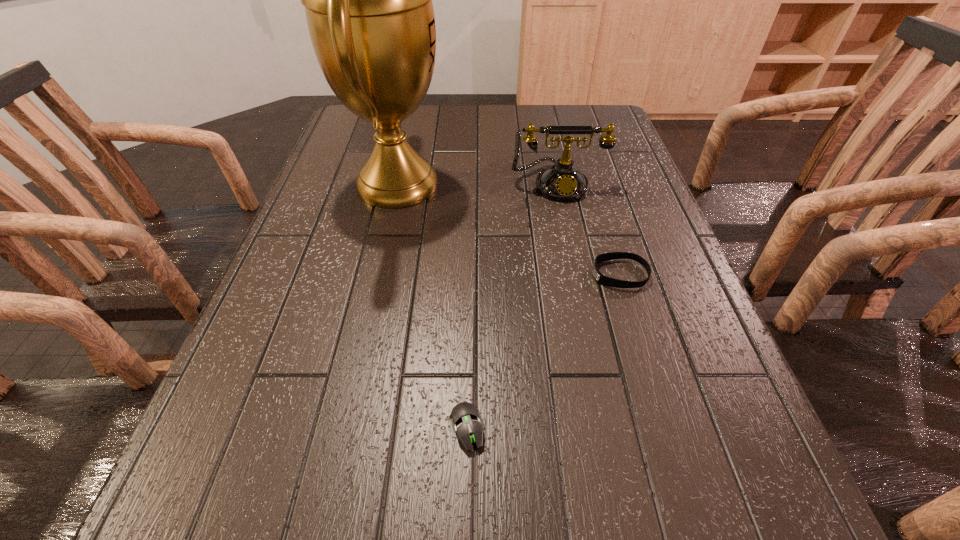
Where is `vacant space situated on the display of the third tallest object`? The image size is (960, 540). vacant space situated on the display of the third tallest object is located at coordinates (487, 274).

Locate an element on the screen. vacant space located 0.080m on the display of the third tallest object is located at coordinates pyautogui.click(x=554, y=274).

The height and width of the screenshot is (540, 960). Identify the location of vacant space positioned on the back of the computer mouse. coord(468,345).

Identify the location of object that is positioned at the far edge. The height and width of the screenshot is (540, 960). (368, 0).

This screenshot has width=960, height=540. Find the location of `object located at the left edge`. object located at the left edge is located at coordinates (368, 0).

The image size is (960, 540). I want to click on telephone that is at the right edge, so click(x=562, y=181).

Where is `wristband present at the right edge`? This screenshot has height=540, width=960. wristband present at the right edge is located at coordinates (600, 278).

What are the coordinates of `object present at the far left corner` in the screenshot? It's located at (368, 0).

Image resolution: width=960 pixels, height=540 pixels. In the image, there is a desktop. What are the coordinates of `vacant space at the far edge` in the screenshot? It's located at (422, 117).

The height and width of the screenshot is (540, 960). I want to click on vacant area at the near edge, so click(423, 511).